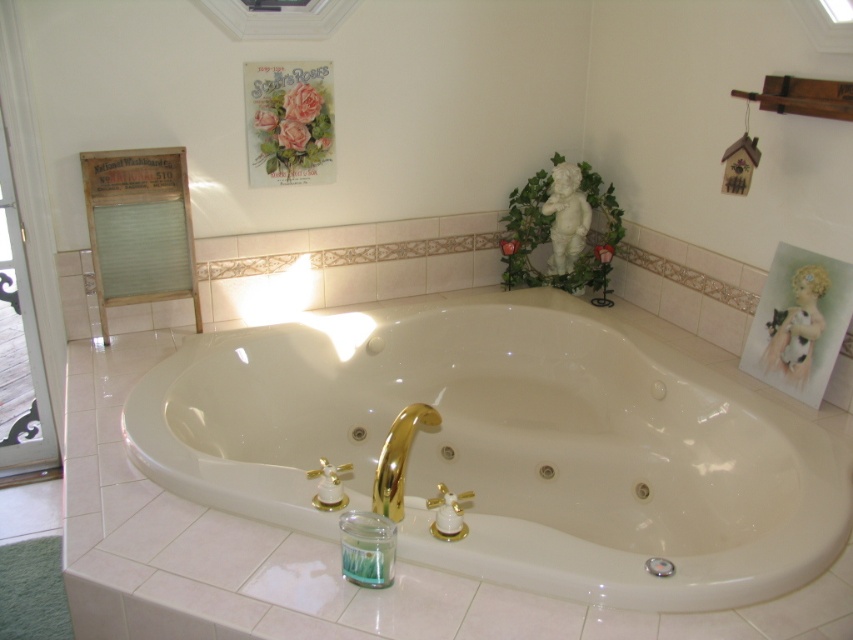
You are a delivery person trying to bring a new bathtub into the bathroom. The existing white glossy bathtub at center is in the way of the entrance. Can you move the new bathtub through the clear glass screen door at left without rotating it?

The white glossy bathtub at center is wider than the clear glass screen door at left, so the new bathtub cannot pass through the clear glass screen door at left without rotating it since its width exceeds the door width.